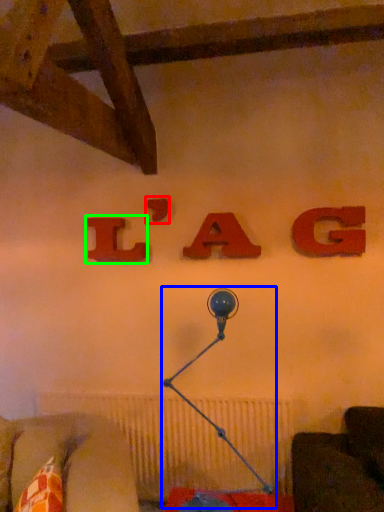
Question: Based on their relative distances, which object is farther from alphabet (highlighted by a red box)? Choose from table lamp (highlighted by a blue box) and alphabet (highlighted by a green box).

Choices:
 (A) table lamp
 (B) alphabet

Answer: (A)